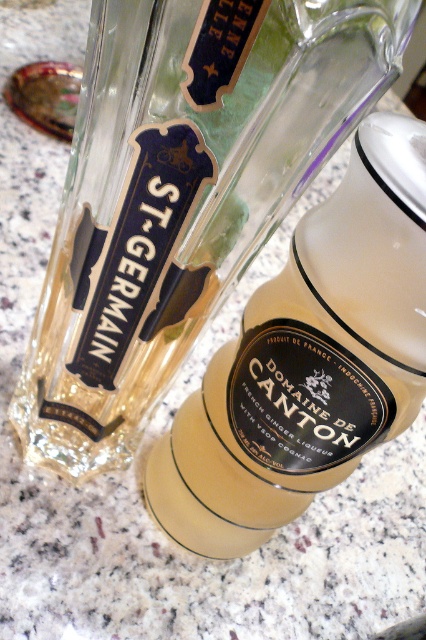
Which of these two, clear glass bottle at center or translucent glass bottle at center, stands shorter?

clear glass bottle at center

Which is above, clear glass bottle at center or translucent glass bottle at center?

clear glass bottle at center is higher up.

Where is `clear glass bottle at center`? Image resolution: width=426 pixels, height=640 pixels. clear glass bottle at center is located at coordinates (181, 193).